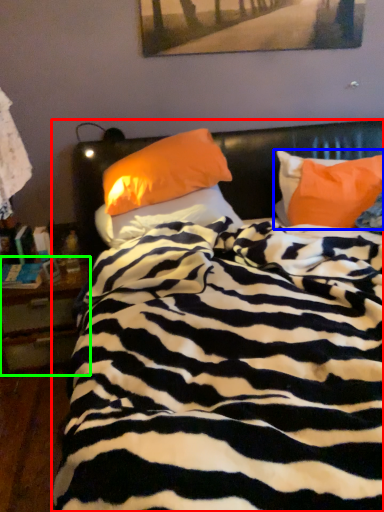
Question: Based on their relative distances, which object is farther from bed (highlighted by a red box)? Choose from pillow (highlighted by a blue box) and nightstand (highlighted by a green box).

Choices:
 (A) pillow
 (B) nightstand

Answer: (B)